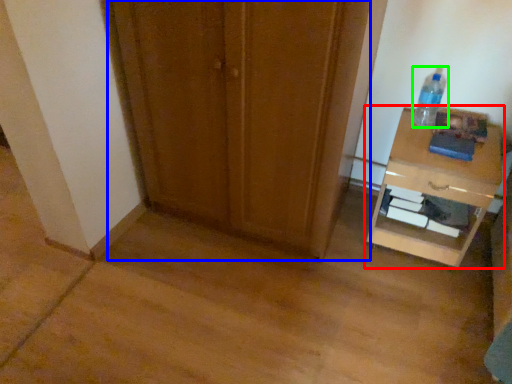
Question: Which is farther away from nightstand (highlighted by a red box)? door (highlighted by a blue box) or bottle (highlighted by a green box)?

Choices:
 (A) door
 (B) bottle

Answer: (A)